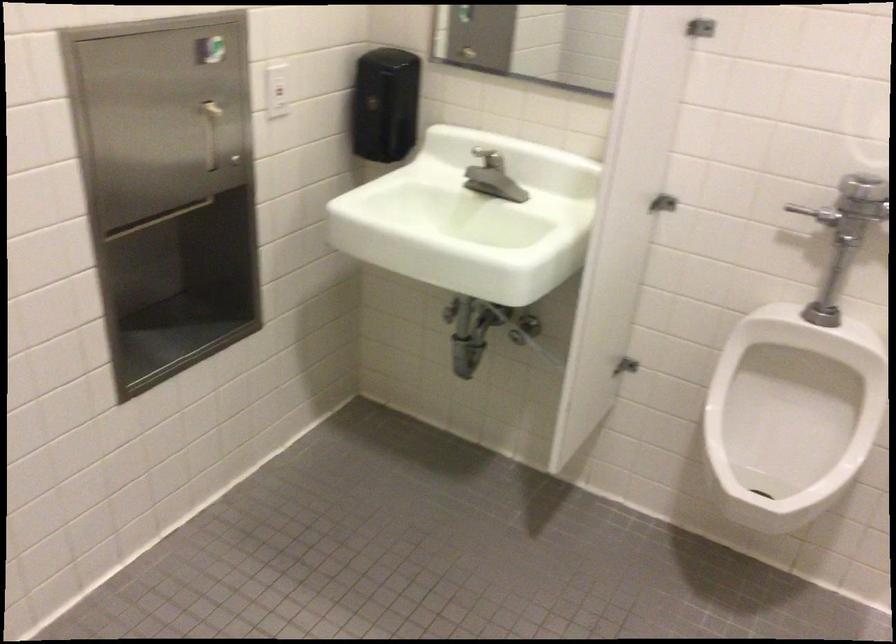
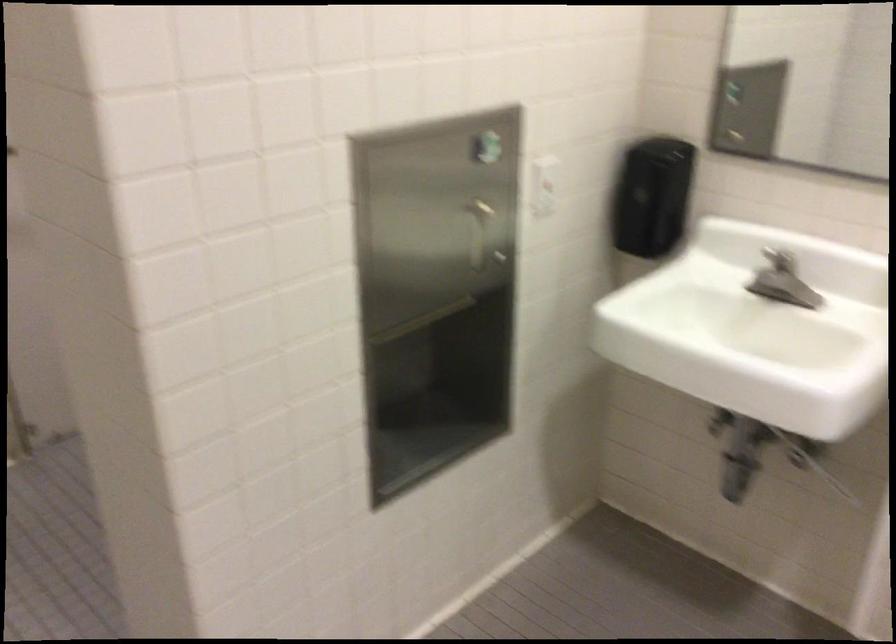
Find the pixel in the second image that matches point 489,178 in the first image.

(782, 281)